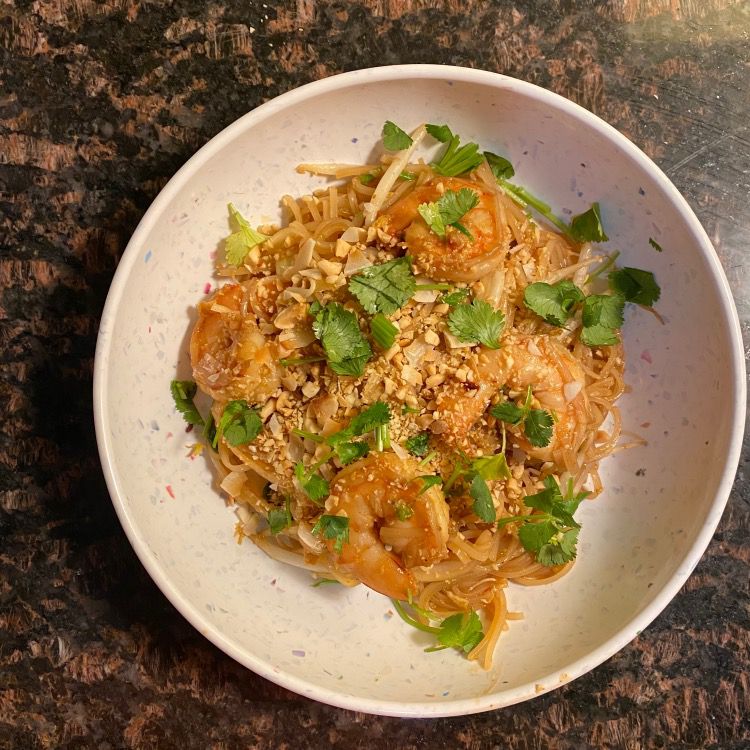
At what (x,y) coordinates should I click in order to perform the action: click on granite tabletop upper right. Please return your answer as a coordinate pair (x, y). This screenshot has height=750, width=750. Looking at the image, I should click on (673, 99).